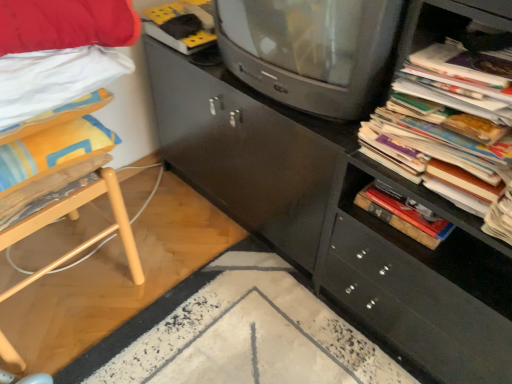
Locate an element on the screen. Image resolution: width=512 pixels, height=384 pixels. vacant space underneath light wood chair at left (from a real-world perspective) is located at coordinates (67, 294).